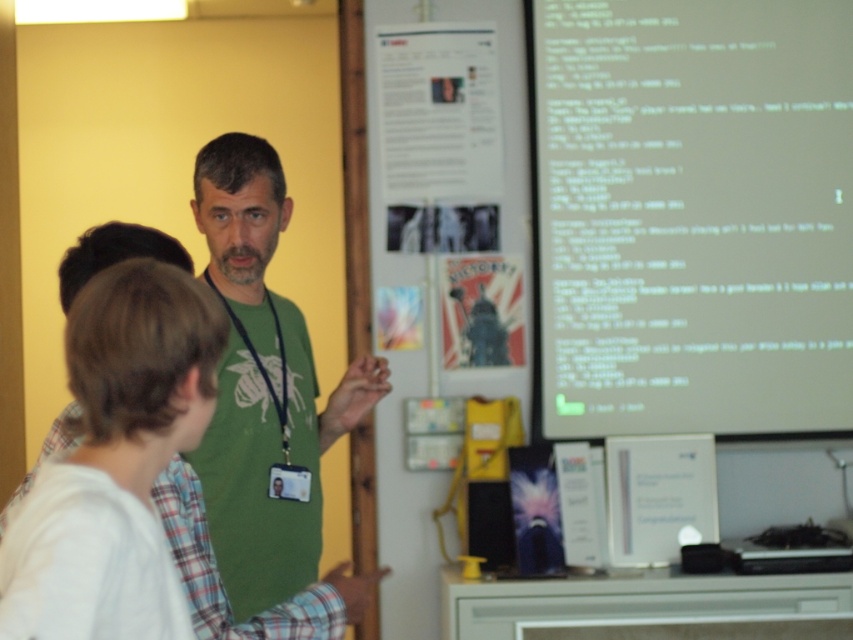
What is the exact coordinate of the green text on white paper at upper right?

The green text on white paper at upper right is located at point (694, 216).

From the picture: You are standing in the room and want to read the green text on white paper at upper right. The point where you are standing is at coordinate (694, 216). Is the green text on white paper at upper right located to your left or right side?

The green text on white paper at upper right is located at point (694, 216), which is to your right side.

You are standing at the point with coordinates point (289, 465) and want to move to the point with coordinates point (814, 428). Is the target point behind you or in front of you?

The point (814, 428) is behind point (289, 465), so the target point is behind you.